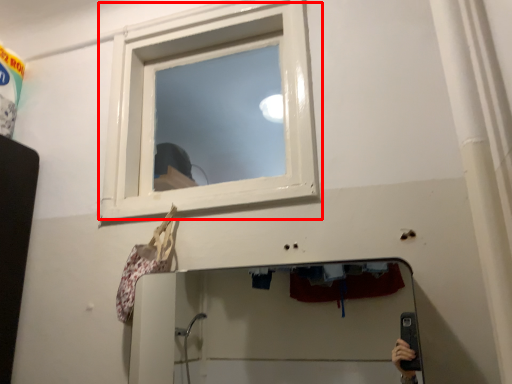
Question: From the image, what is the correct spatial relationship of window (annotated by the red box) in relation to mirror?

Choices:
 (A) left
 (B) right

Answer: (A)